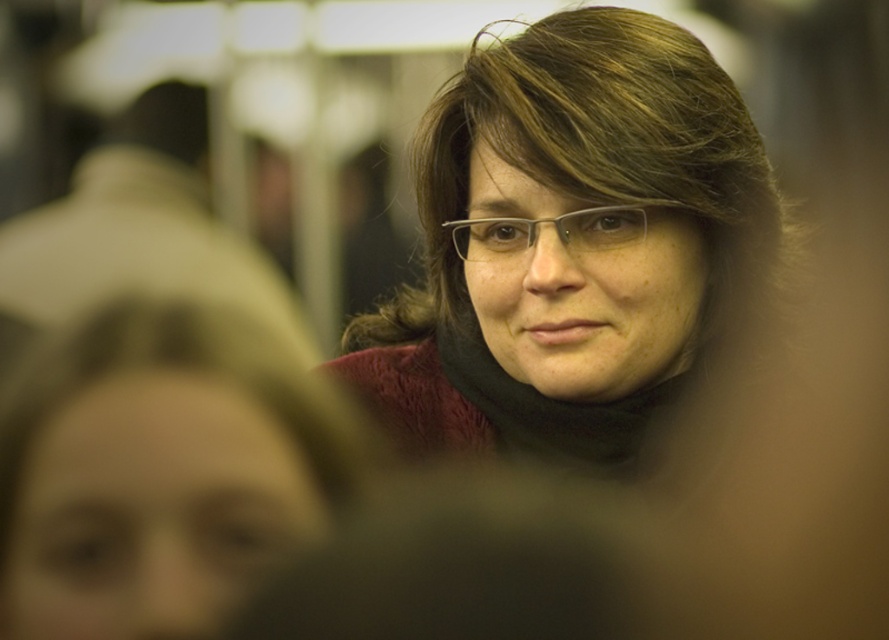
Which is in front, point (639, 224) or point (315, 397)?

Point (315, 397) is in front.

Is matte black scarf at center further to camera compared to matte black scarf at upper center?

Yes, it is.

Is point (643, 106) in front of point (10, 513)?

No, it is not.

This screenshot has width=889, height=640. Identify the location of matte black scarf at center. (574, 250).

Who is higher up, matte black scarf at center or clear plastic glasses at center?

clear plastic glasses at center

Between matte black scarf at center and clear plastic glasses at center, which one has more height?

matte black scarf at center is taller.

The height and width of the screenshot is (640, 889). I want to click on matte black scarf at center, so pos(574,250).

This screenshot has width=889, height=640. I want to click on matte black scarf at center, so click(574, 250).

Is matte black scarf at upper center to the left of clear plastic glasses at center from the viewer's perspective?

Correct, you'll find matte black scarf at upper center to the left of clear plastic glasses at center.

Does point (351, 429) come closer to viewer compared to point (638, 204)?

Yes.

Between point (202, 396) and point (641, 220), which one is positioned behind?

The point (641, 220) is more distant.

At what (x,y) coordinates should I click in order to perform the action: click on matte black scarf at upper center. Please return your answer as a coordinate pair (x, y). Looking at the image, I should click on (161, 476).